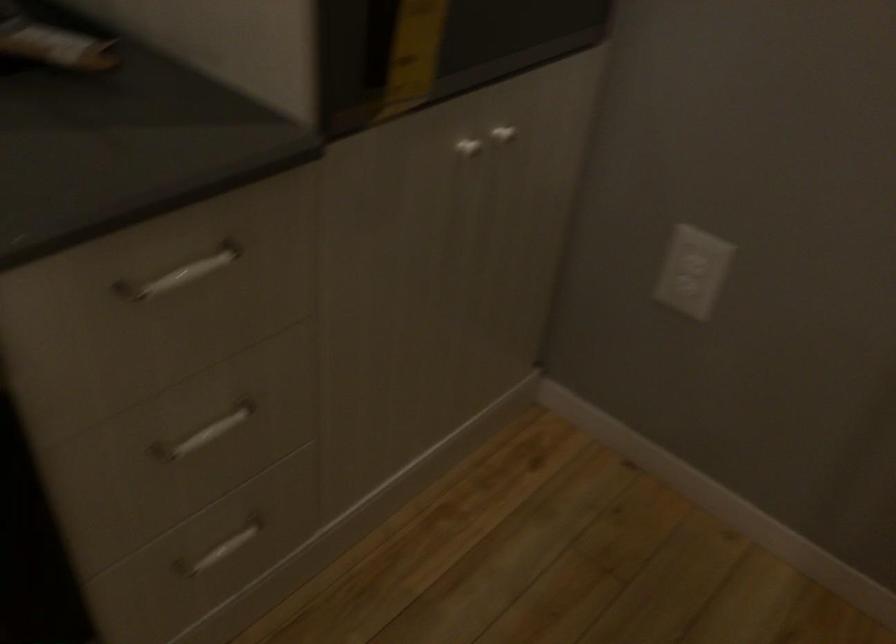
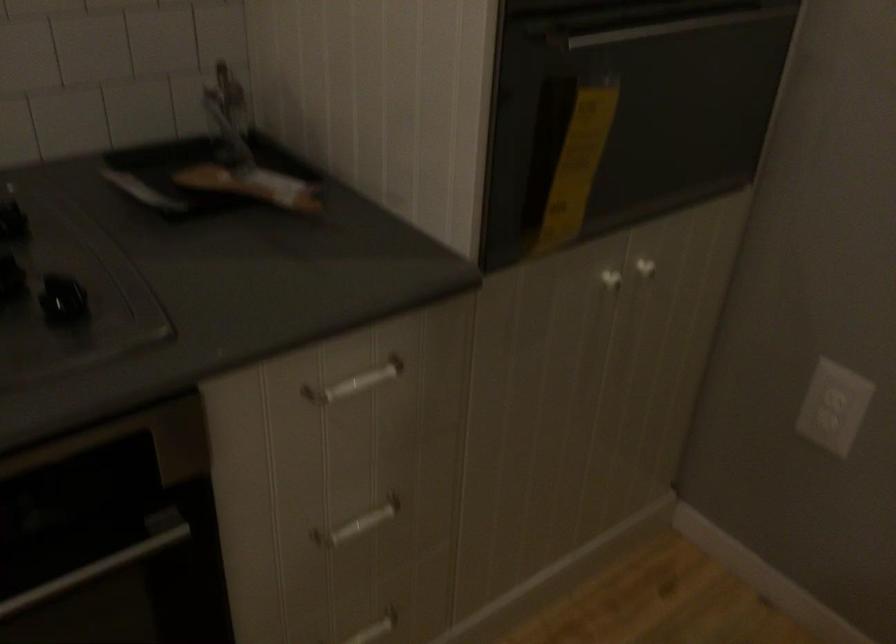
In the second image, find the point that corresponds to (505,131) in the first image.

(645, 268)